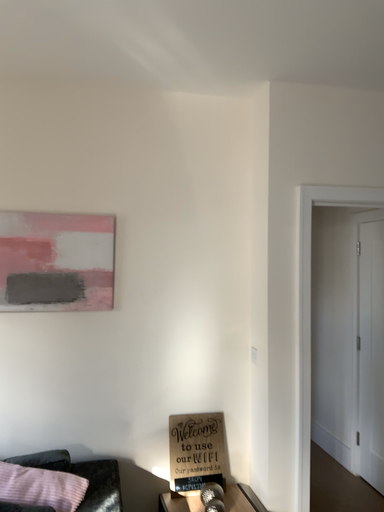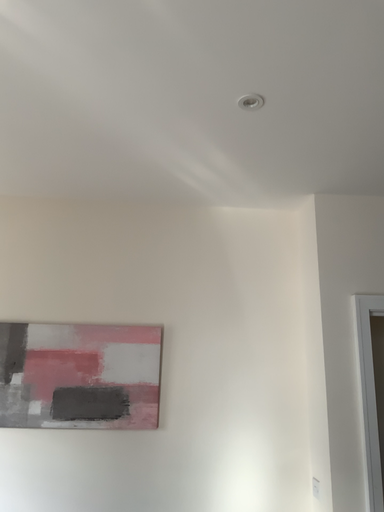
Question: Which way did the camera rotate in the video?

Choices:
 (A) rotated left
 (B) rotated right

Answer: (A)